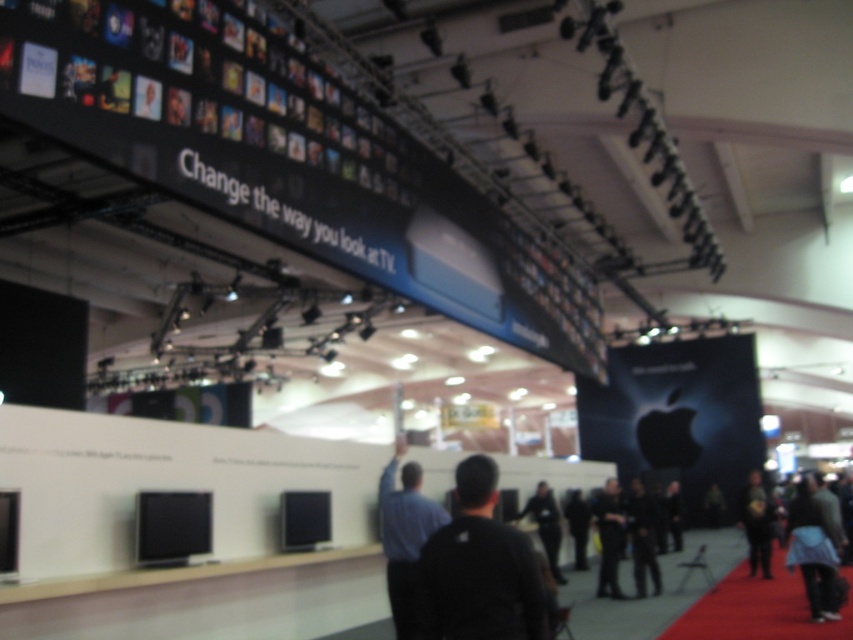
You are standing at the entrance of the exhibition and notice two items at the lower right corner of the image. Which one is positioned higher between the dark gray fabric pants at lower right and the black leather jacket at lower right?

The dark gray fabric pants at lower right is located above the black leather jacket at lower right, so it is positioned higher.

You are a photographer at the event and need to capture a photo of both the black leather jacket at lower right and the dark gray sweater at lower right in the same frame. The camera you are using has a focal length of 50mm. Considering the distance between them, would you need to adjust your position to include both subjects in the shot?

The black leather jacket at lower right and dark gray sweater at lower right are 1.78 meters apart. With a 50mm focal length, you would likely need to step back slightly to ensure both subjects fit within the frame, as 1.78 meters may be wider than the standard field of view at that focal length.